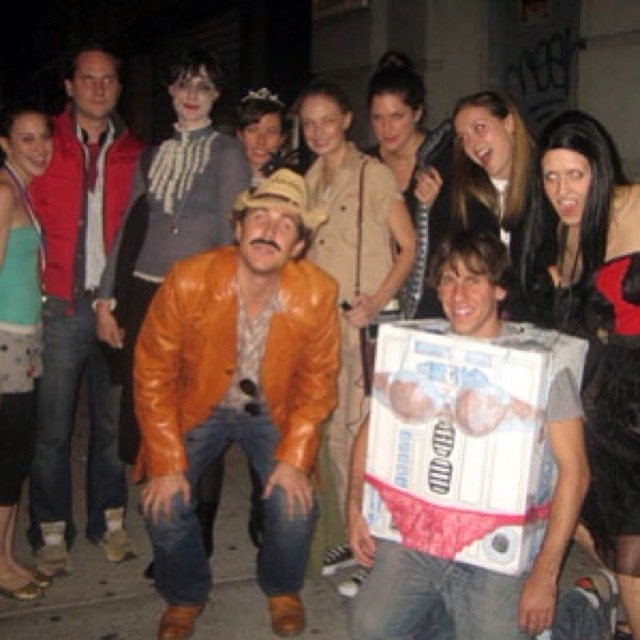
Which is above, black satin dress at lower right or matte beige dress at center?

matte beige dress at center is above.

Is point (632, 509) positioned before point (403, 96)?

That is True.

Who is more distant from viewer, [612,333] or [371,90]?

The point [371,90] is behind.

You are a GUI agent. You are given a task and a screenshot of the screen. Output one action in this format:
    pyautogui.click(x=<x>, y=<y>)
    Task: Click on the black satin dress at lower right
    
    Given the screenshot: What is the action you would take?
    pyautogui.click(x=612, y=401)

Can you confirm if matte red vest at left is bigger than tan suede jacket at center?

Indeed, matte red vest at left has a larger size compared to tan suede jacket at center.

You are a GUI agent. You are given a task and a screenshot of the screen. Output one action in this format:
    pyautogui.click(x=<x>, y=<y>)
    Task: Click on the matte red vest at left
    
    Given the screenshot: What is the action you would take?
    pyautogui.click(x=80, y=310)

Between orange leather jacket at center and black satin dress at lower right, which one appears on the right side from the viewer's perspective?

black satin dress at lower right

Which is below, orange leather jacket at center or black satin dress at lower right?

orange leather jacket at center is lower down.

Consider the image. Measure the distance between orange leather jacket at center and camera.

They are 13.14 feet apart.

Identify the location of orange leather jacket at center. This screenshot has width=640, height=640. (237, 396).